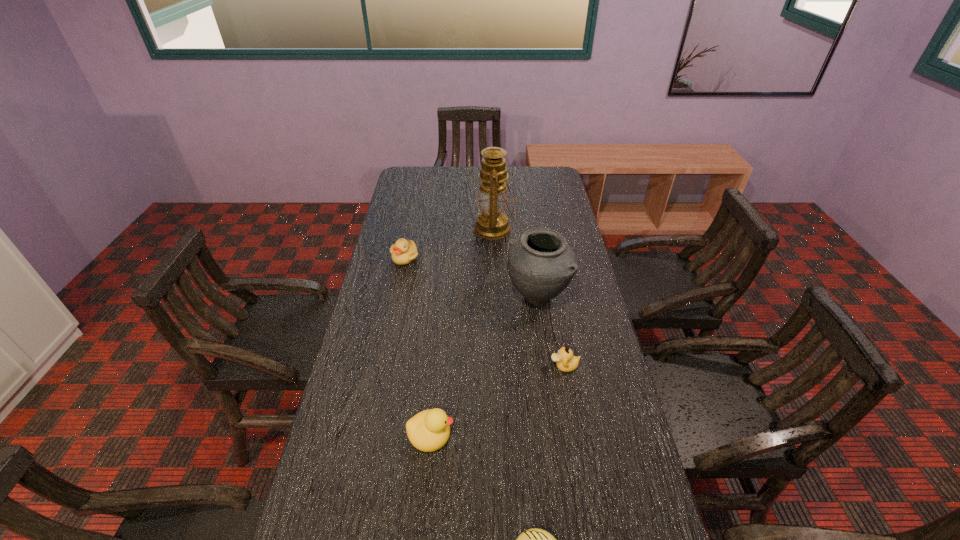
Identify the location of the tallest object. The width and height of the screenshot is (960, 540). (492, 223).

Locate an element on the screen. The width and height of the screenshot is (960, 540). the farthest object is located at coordinates (492, 223).

This screenshot has height=540, width=960. Identify the location of the fourth nearest object. (541, 264).

The height and width of the screenshot is (540, 960). Find the location of `urn`. urn is located at coordinates coord(541,264).

You are a GUI agent. You are given a task and a screenshot of the screen. Output one action in this format:
    pyautogui.click(x=<x>, y=<y>)
    Task: Click on the leftmost object
    
    Given the screenshot: What is the action you would take?
    (404, 252)

Where is `the second farthest object`? Image resolution: width=960 pixels, height=540 pixels. the second farthest object is located at coordinates (404, 252).

Where is `the second object from left to right`? The width and height of the screenshot is (960, 540). the second object from left to right is located at coordinates (429, 430).

This screenshot has height=540, width=960. I want to click on the third duckling from right to left, so click(429, 430).

This screenshot has width=960, height=540. In order to click on the rightmost duckling in this screenshot , I will do `click(565, 361)`.

Image resolution: width=960 pixels, height=540 pixels. What are the coordinates of `the second farthest duckling` in the screenshot? It's located at (565, 361).